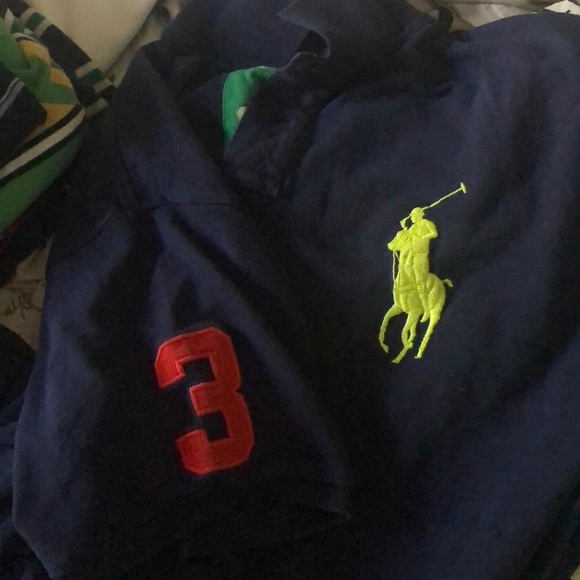
Locate an element on the screen. The height and width of the screenshot is (580, 580). white sheet is located at coordinates (118, 21).